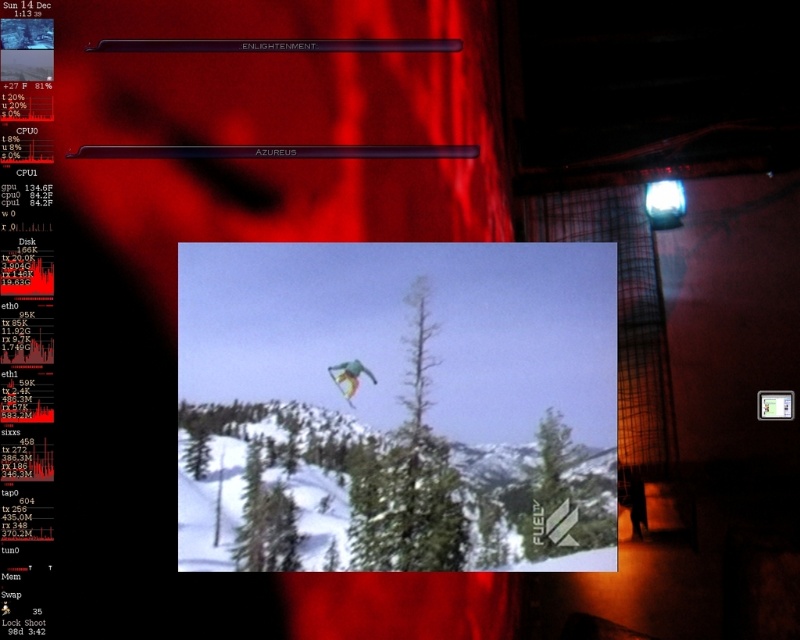
Consider the image. You are standing in front of the computer screen and want to touch the point at coordinates (x=438, y=266) on the screen. Can you reach it without moving your hand more than 1.5 meters?

The point at coordinates (x=438, y=266) is 1.44 meters from the camera, so yes, you can reach it without moving your hand more than 1.5 meters.

You are looking at a computer screen that has a green fabric kite at center and a multicolored fabric snowboarder at center. Which object is positioned lower on the screen?

The green fabric kite at center is located below the multicolored fabric snowboarder at center, so it is positioned lower on the screen.

You are designing a poster and want to place the green fabric kite at center and the multicolored fabric snowboarder at center on it. The poster has a maximum width of 10 inches. Can both elements fit side by side without overlapping?

The green fabric kite at center and the multicolored fabric snowboarder at center are 7.23 inches apart from each other. Since the total required space is 7.23 inches and the poster is 10 inches wide, there is enough space to fit both elements side by side without overlapping.